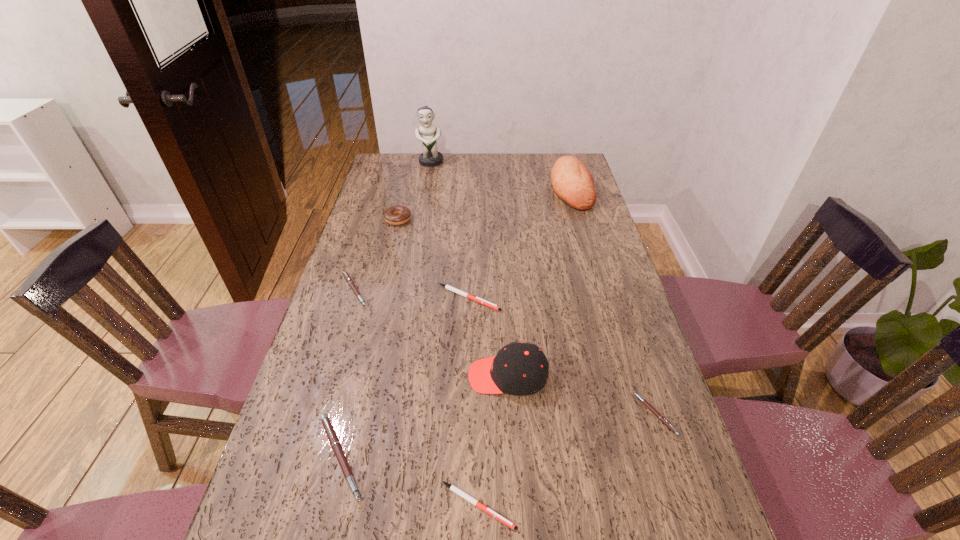
The image size is (960, 540). I want to click on figurine, so click(x=430, y=157).

Where is `the tallest object`? This screenshot has width=960, height=540. the tallest object is located at coordinates (430, 157).

Identify the location of bread. (572, 182).

You are a GUI agent. You are given a task and a screenshot of the screen. Output one action in this format:
    pyautogui.click(x=<x>, y=<y>)
    Task: Click on the cap
    The width and height of the screenshot is (960, 540).
    Given the screenshot: What is the action you would take?
    pyautogui.click(x=519, y=369)

At what (x,y) coordinates should I click in order to perform the action: click on doughnut. Please return your answer as a coordinate pair (x, y). Looking at the image, I should click on (396, 215).

Where is `brown doughnut`? brown doughnut is located at coordinates (396, 215).

The width and height of the screenshot is (960, 540). In order to click on the tallest pen in this screenshot , I will do `click(328, 427)`.

I want to click on the fifth tallest object, so click(328, 427).

The image size is (960, 540). I want to click on the farthest pink pen, so click(345, 274).

The height and width of the screenshot is (540, 960). I want to click on the farther white pen, so click(x=477, y=299).